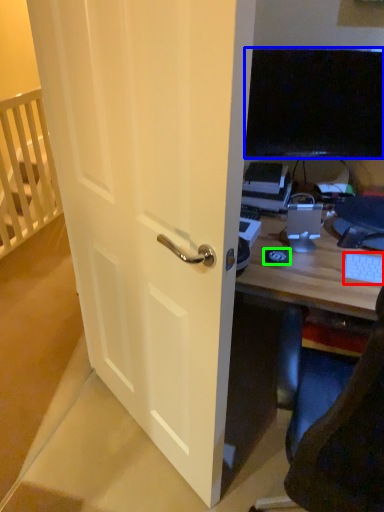
Question: Based on their relative distances, which object is farther from computer keyboard (highlighted by a red box)? Choose from television (highlighted by a blue box) and mousepad (highlighted by a green box).

Choices:
 (A) television
 (B) mousepad

Answer: (A)